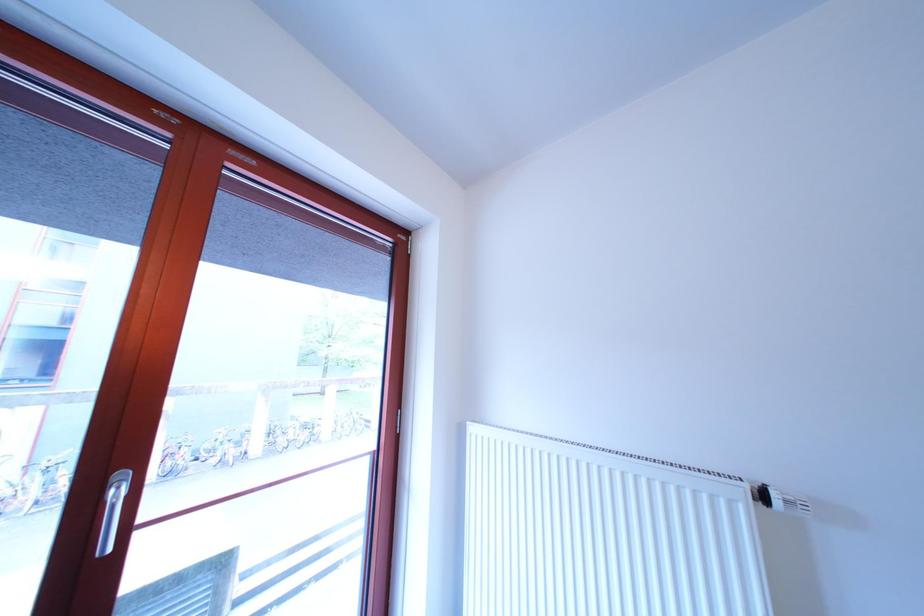
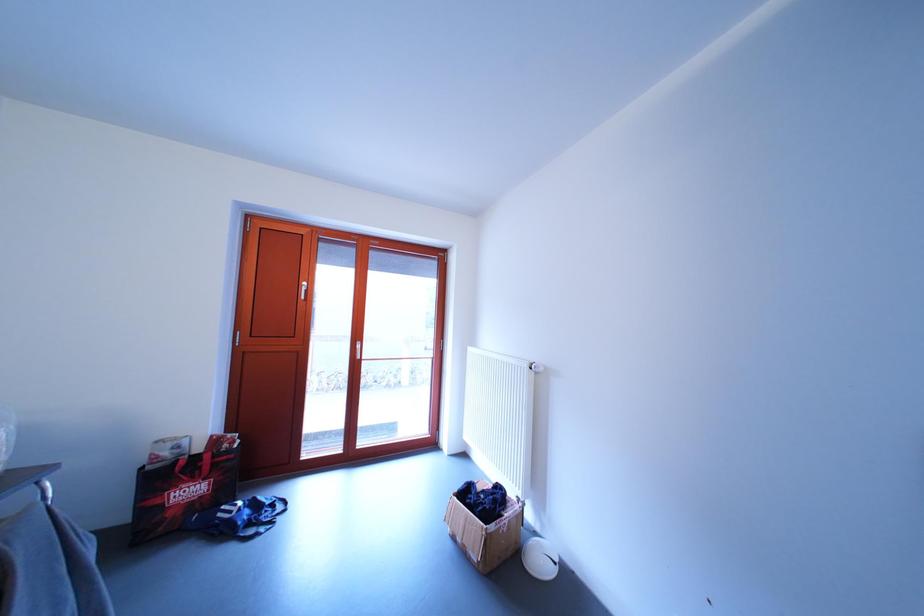
What movement of the cameraman would produce the second image?

The movement direction of the cameraman is right, backward.